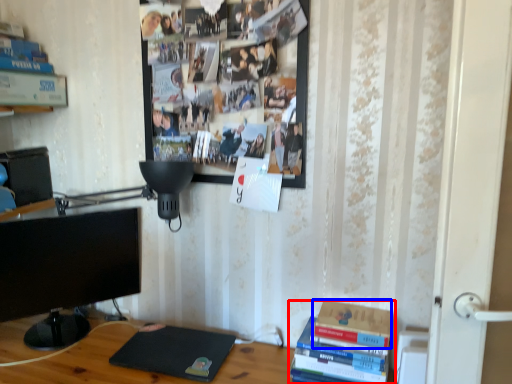
Question: Which object appears farthest to the camera in this image, book (highlighted by a red box) or paperback book (highlighted by a blue box)?

Choices:
 (A) book
 (B) paperback book

Answer: (B)